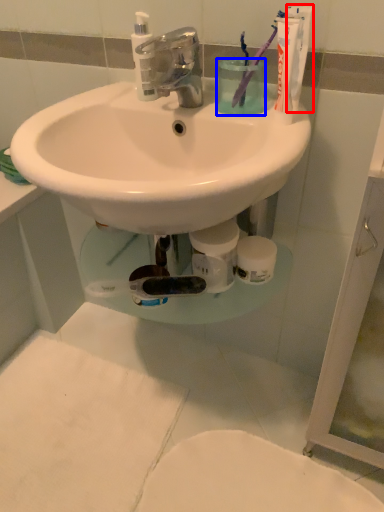
Question: Which point is further to the camera, toothpaste (highlighted by a red box) or liquid (highlighted by a blue box)?

Choices:
 (A) toothpaste
 (B) liquid

Answer: (B)